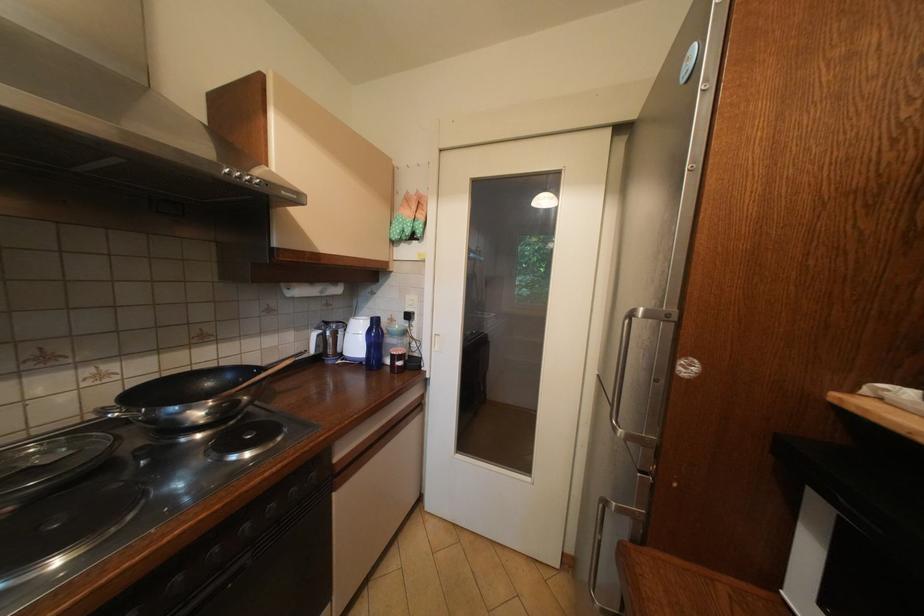
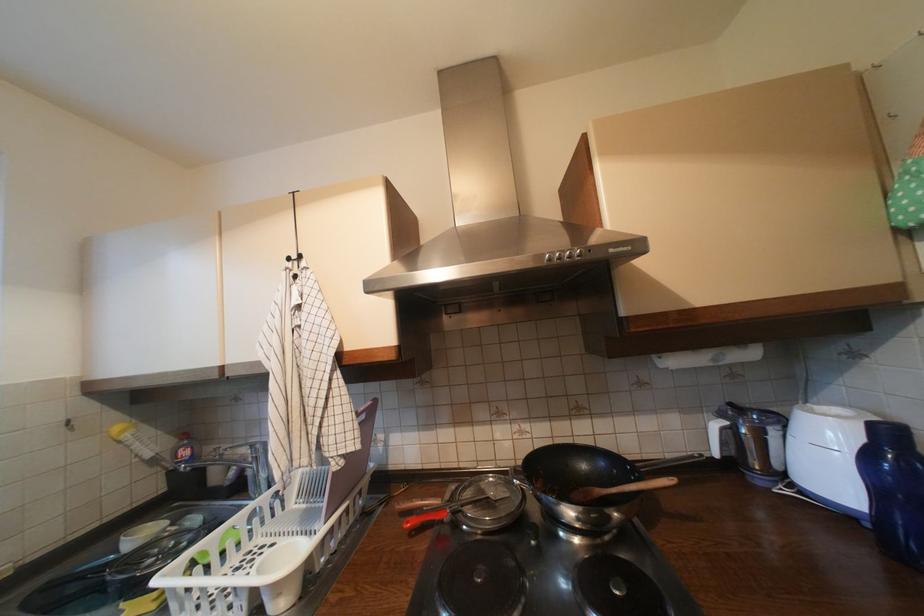
Locate, in the second image, the point that corresponds to (x=329, y=333) in the first image.

(735, 424)